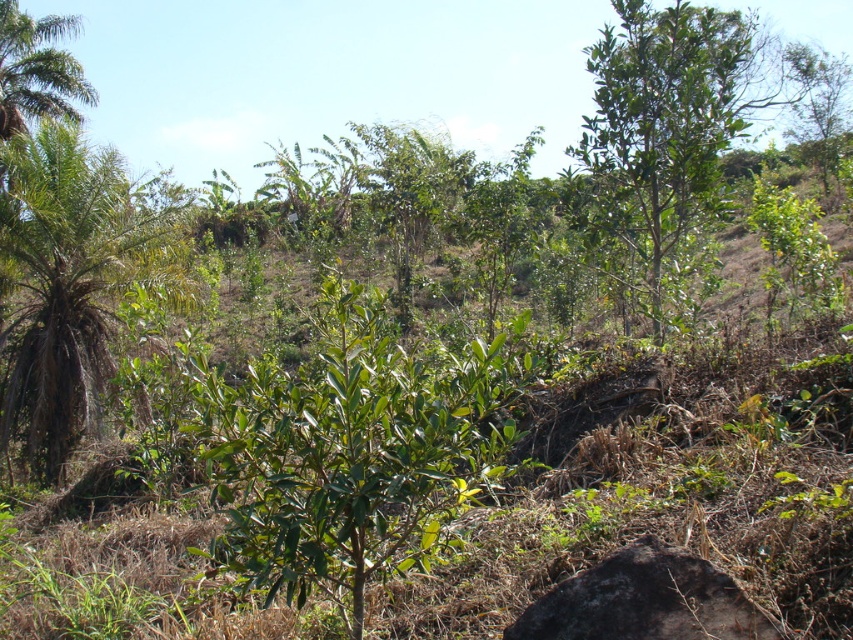
Question: Considering the relative positions of green leafy palm tree at left and dark gray rock at lower right in the image provided, where is green leafy palm tree at left located with respect to dark gray rock at lower right?

Choices:
 (A) left
 (B) right

Answer: (A)

Question: Which of the following is the farthest from the observer?

Choices:
 (A) (74, 419)
 (B) (689, 209)
 (C) (642, 577)

Answer: (A)

Question: Considering the real-world distances, which object is farthest from the green leafy palm tree at left?

Choices:
 (A) green leafy tree at upper right
 (B) dark gray rock at lower right

Answer: (A)

Question: Can you confirm if green leafy palm tree at left is smaller than dark gray rock at lower right?

Choices:
 (A) yes
 (B) no

Answer: (B)

Question: From the image, what is the correct spatial relationship of green leafy tree at upper right in relation to dark gray rock at lower right?

Choices:
 (A) above
 (B) below

Answer: (A)

Question: Considering the real-world distances, which object is closest to the green leafy tree at upper right?

Choices:
 (A) dark gray rock at lower right
 (B) green leafy palm tree at left

Answer: (A)